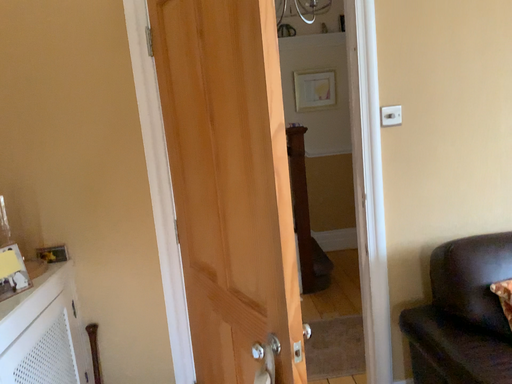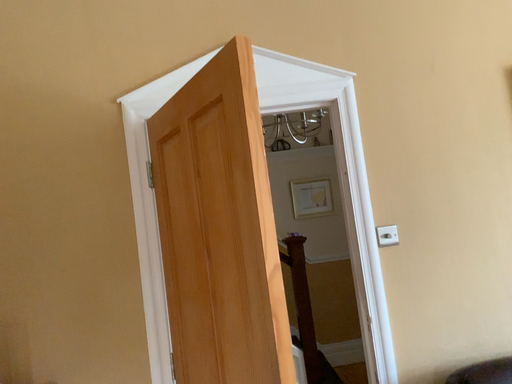
Question: How did the camera likely rotate when shooting the video?

Choices:
 (A) rotated downward
 (B) rotated upward

Answer: (B)